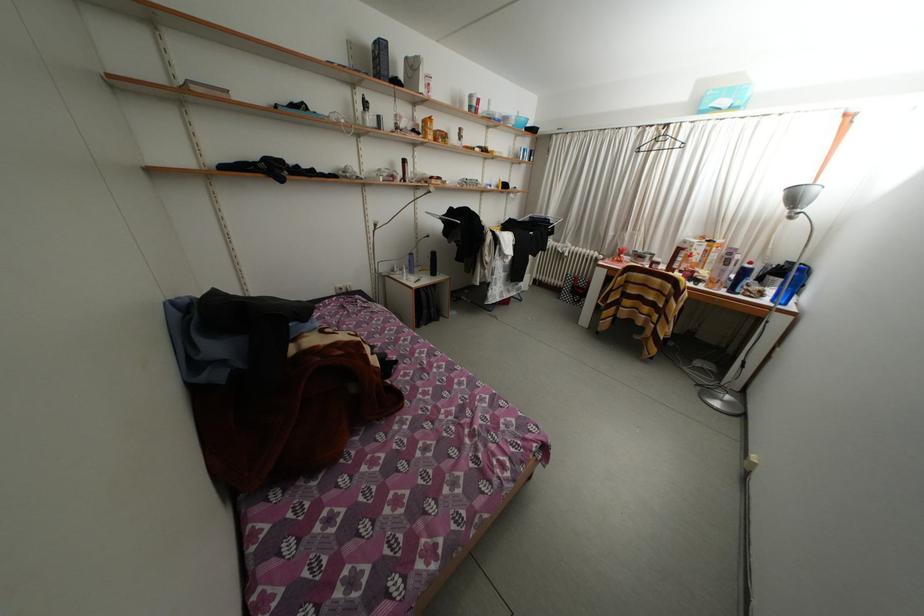
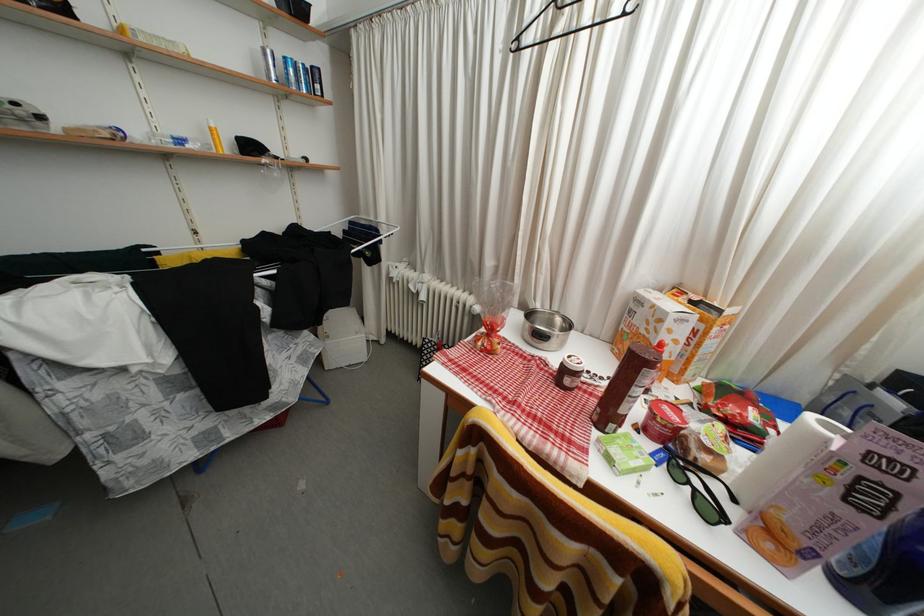
Which direction would the cameraman need to move to produce the second image?

The cameraman moved toward right, forward.